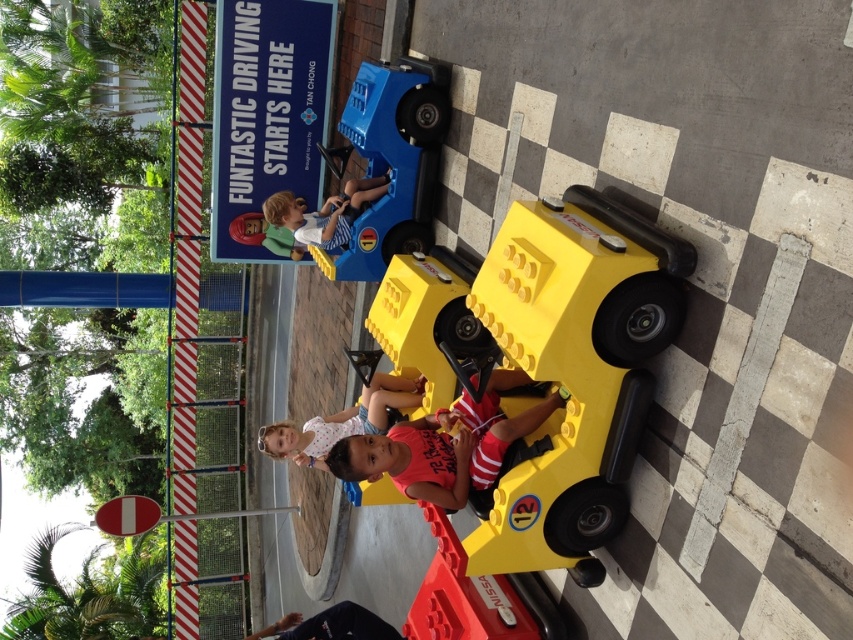
You are a parent watching your child play in the theme park. You notice a yellow plastic toy car at center and a matte pink shirt at center. Which object is positioned to the right of the other?

The yellow plastic toy car at center is to the right of the matte pink shirt at center.

You are a photographer trying to capture a group photo of the children in the toy car. Since the matte pink shirt at center and the matte blue shirt at center are sitting side by side, which child should you position closer to the center to ensure both shirts are equally visible in the photo?

The matte pink shirt at center is wider than the matte blue shirt at center. To balance their visibility, position the matte blue shirt at center slightly closer to the center of the frame since it is narrower, allowing both shirts to occupy similar visual space.

You are standing in front of the bright yellow toy car at the theme park. There are two points marked on the car. The first point is at coordinates point (300, 228) and the second point is at point (316, 627). Which of these two points is closer to you?

Point (300, 228) is closer to you because it is further to the viewer than point (316, 627).